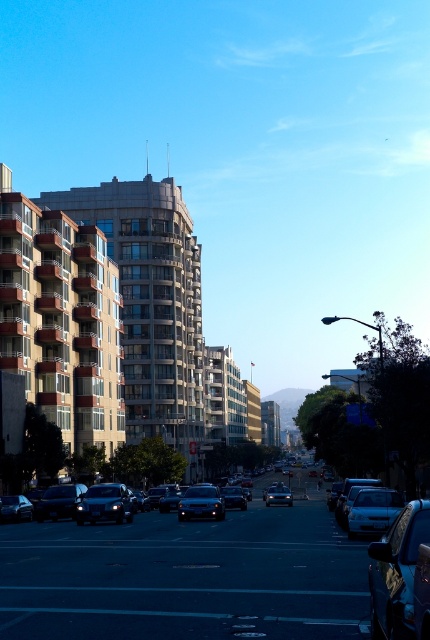
Question: Can you confirm if shiny black sedan at lower left is wider than shiny silver sedan at center?

Choices:
 (A) yes
 (B) no

Answer: (A)

Question: Is shiny black car at lower right wider than shiny black sedan at center?

Choices:
 (A) no
 (B) yes

Answer: (A)

Question: Can you confirm if shiny black car at lower right is bigger than shiny black sedan at lower left?

Choices:
 (A) no
 (B) yes

Answer: (A)

Question: Which point is farther to the camera?

Choices:
 (A) satin black sedan at center
 (B) shiny black car at lower right

Answer: (A)

Question: Which point is farther to the camera?

Choices:
 (A) (377, 557)
 (B) (119, 515)
 (C) (266, 497)

Answer: (C)

Question: Which of the following is the closest to the observer?

Choices:
 (A) shiny black sedan at lower left
 (B) shiny black car at lower right
 (C) sleek silver sedan at center
 (D) shiny black sedan at center

Answer: (B)